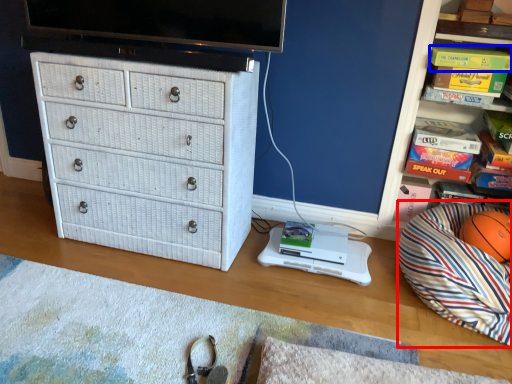
Question: Which object is further to the camera taking this photo, bean bag chair (highlighted by a red box) or book (highlighted by a blue box)?

Choices:
 (A) bean bag chair
 (B) book

Answer: (B)